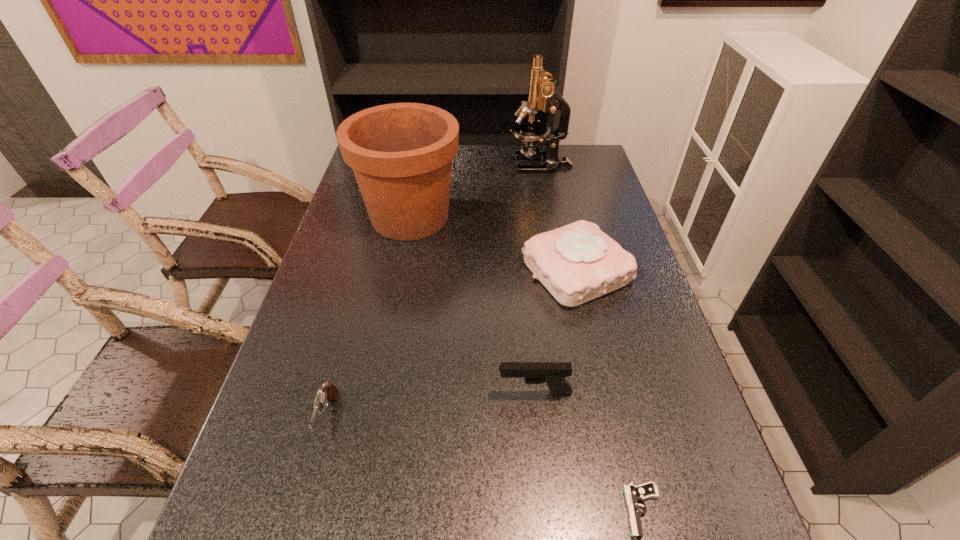
In order to click on the tallest object in this screenshot , I will do `click(542, 94)`.

Where is `microscope`? The height and width of the screenshot is (540, 960). microscope is located at coordinates (542, 94).

Find the location of a particular element. The width and height of the screenshot is (960, 540). the fifth shortest object is located at coordinates (401, 154).

The width and height of the screenshot is (960, 540). I want to click on cake, so point(577,263).

At what (x,y) coordinates should I click in order to perform the action: click on the second pistol from left to right. Please return your answer as a coordinate pair (x, y). Looking at the image, I should click on (553, 373).

You are a GUI agent. You are given a task and a screenshot of the screen. Output one action in this format:
    pyautogui.click(x=<x>, y=<y>)
    Task: Click on the second shortest pistol
    The height and width of the screenshot is (540, 960).
    Given the screenshot: What is the action you would take?
    pyautogui.click(x=328, y=392)

The height and width of the screenshot is (540, 960). What are the coordinates of `the leftmost pistol` in the screenshot? It's located at (x=328, y=392).

Where is `vacant region located 0.350m at the eyepiece of the tallest object`? vacant region located 0.350m at the eyepiece of the tallest object is located at coordinates (415, 165).

Where is `vacant space positioned 0.310m at the eyepiece of the tallest object`? vacant space positioned 0.310m at the eyepiece of the tallest object is located at coordinates (425, 165).

At what (x,y) coordinates should I click in order to perform the action: click on vacant space located 0.180m at the eyepiece of the tallest object. Please return your answer as a coordinate pair (x, y). This screenshot has height=540, width=960. Looking at the image, I should click on (461, 165).